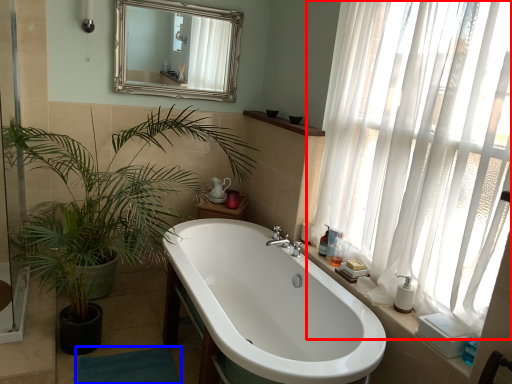
Question: Which object appears farthest to the camera in this image, curtain (highlighted by a red box) or bath mat (highlighted by a blue box)?

Choices:
 (A) curtain
 (B) bath mat

Answer: (B)